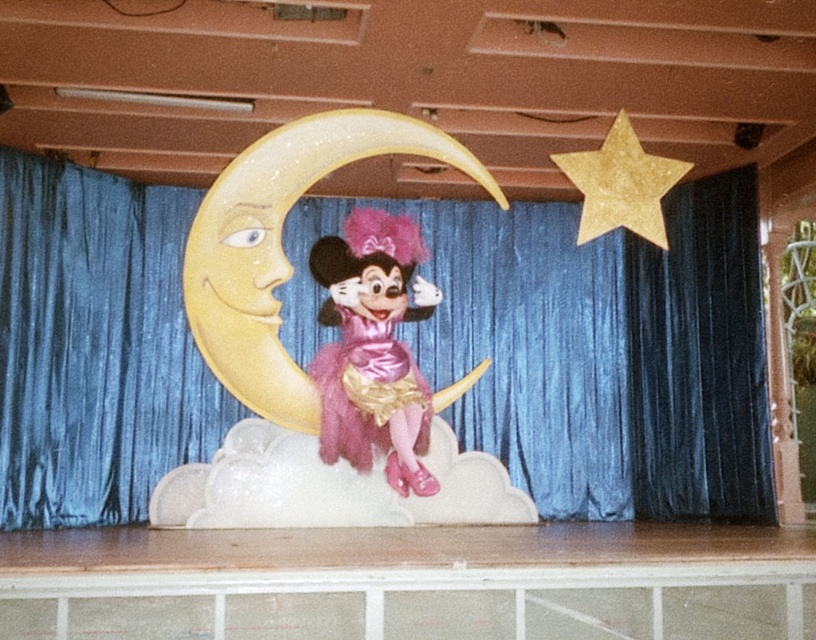
Can you confirm if wooden stage at center is positioned to the left of gold glitter star at upper right?

Indeed, wooden stage at center is positioned on the left side of gold glitter star at upper right.

Does wooden stage at center come in front of gold glitter star at upper right?

No, wooden stage at center is behind gold glitter star at upper right.

Between point (688, 605) and point (579, 164), which one is positioned behind?

Positioned behind is point (688, 605).

Where is `wooden stage at center`? This screenshot has width=816, height=640. wooden stage at center is located at coordinates (420, 577).

How far apart are velvet blue curtain at center and gold glitter star at upper right?

velvet blue curtain at center is 4.20 meters away from gold glitter star at upper right.

Is point (559, 273) closer to camera compared to point (605, 182)?

No.

Image resolution: width=816 pixels, height=640 pixels. What do you see at coordinates (608, 353) in the screenshot?
I see `velvet blue curtain at center` at bounding box center [608, 353].

You are a GUI agent. You are given a task and a screenshot of the screen. Output one action in this format:
    pyautogui.click(x=<x>, y=<y>)
    Task: Click on the velvet blue curtain at center
    The height and width of the screenshot is (640, 816).
    Given the screenshot: What is the action you would take?
    pyautogui.click(x=608, y=353)

Between point (371, 412) and point (646, 204), which one is positioned behind?

Positioned behind is point (371, 412).

Does pink satin doll at center appear on the right side of gold glitter star at upper right?

In fact, pink satin doll at center is to the left of gold glitter star at upper right.

Who is more distant from viewer, (384, 412) or (586, 195)?

The point (384, 412) is behind.

Find the location of a particular element. The image size is (816, 640). pink satin doll at center is located at coordinates (373, 348).